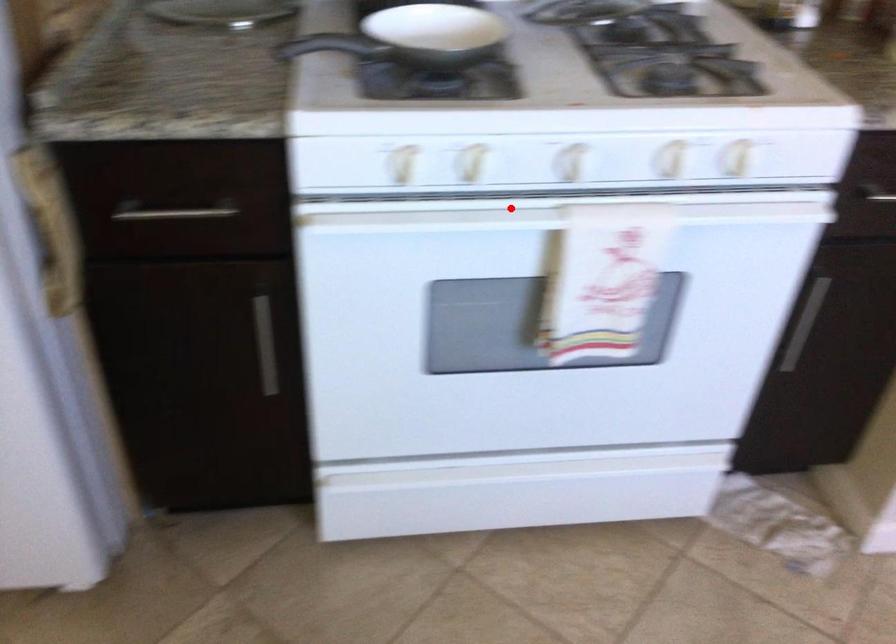
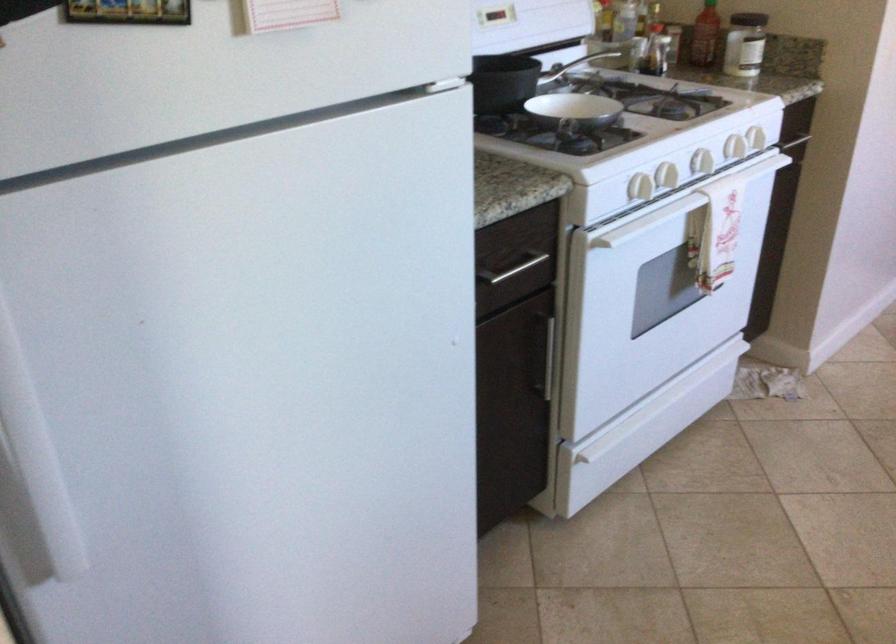
Question: I am providing you with two images of the same scene from different viewpoints. A red point is marked on the first image. Can you still see the location of the red point in image 2?

Choices:
 (A) Yes
 (B) No

Answer: (A)